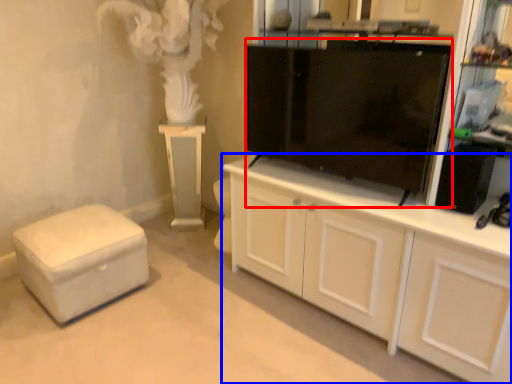
Question: Which object appears closest to the camera in this image, tv cabinet (highlighted by a red box) or cabinetry (highlighted by a blue box)?

Choices:
 (A) tv cabinet
 (B) cabinetry

Answer: (B)